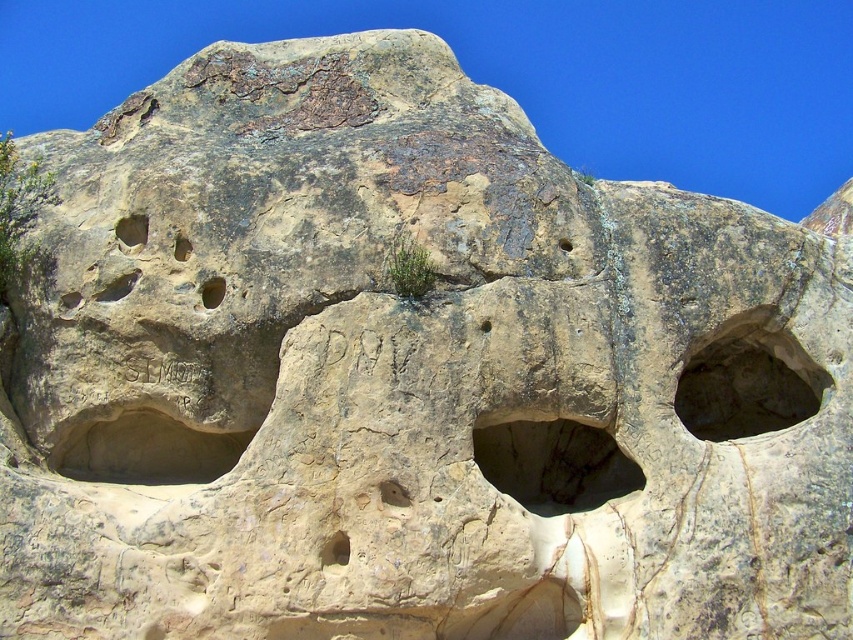
The height and width of the screenshot is (640, 853). What are the coordinates of `smooth beige rock at lower left` in the screenshot? It's located at (148, 451).

Is point (177, 474) closer to camera compared to point (78, 294)?

No, it is behind (78, 294).

This screenshot has width=853, height=640. What are the coordinates of `smooth beige rock at lower left` in the screenshot? It's located at (148, 451).

Does yellow rock hole at center have a greater height compared to smooth beige rock at upper left?

Yes, yellow rock hole at center is taller than smooth beige rock at upper left.

Locate an element on the screen. The width and height of the screenshot is (853, 640). yellow rock hole at center is located at coordinates (212, 291).

Find the location of a particular element. The width and height of the screenshot is (853, 640). yellow rock hole at center is located at coordinates tap(212, 291).

Does dark brown stone hole at right have a lesser height compared to yellowish rock hole at upper center?

Incorrect, dark brown stone hole at right's height does not fall short of yellowish rock hole at upper center's.

Who is higher up, dark brown stone hole at right or yellowish rock hole at upper center?

yellowish rock hole at upper center

This screenshot has width=853, height=640. Identify the location of dark brown stone hole at right. (747, 385).

You are a GUI agent. You are given a task and a screenshot of the screen. Output one action in this format:
    pyautogui.click(x=<x>, y=<y>)
    Task: Click on the dark brown stone hole at right
    
    Given the screenshot: What is the action you would take?
    pyautogui.click(x=747, y=385)